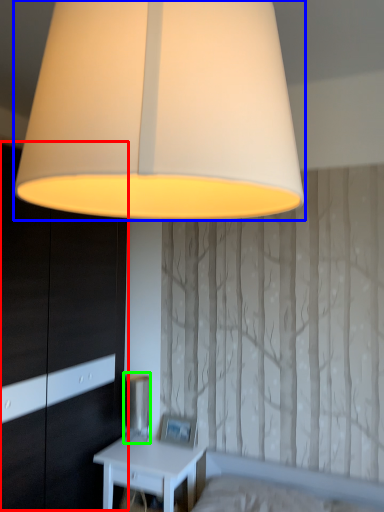
Question: Considering the real-world distances, which object is closest to dresser (highlighted by a red box)? lamp (highlighted by a blue box) or table lamp (highlighted by a green box).

Choices:
 (A) lamp
 (B) table lamp

Answer: (B)